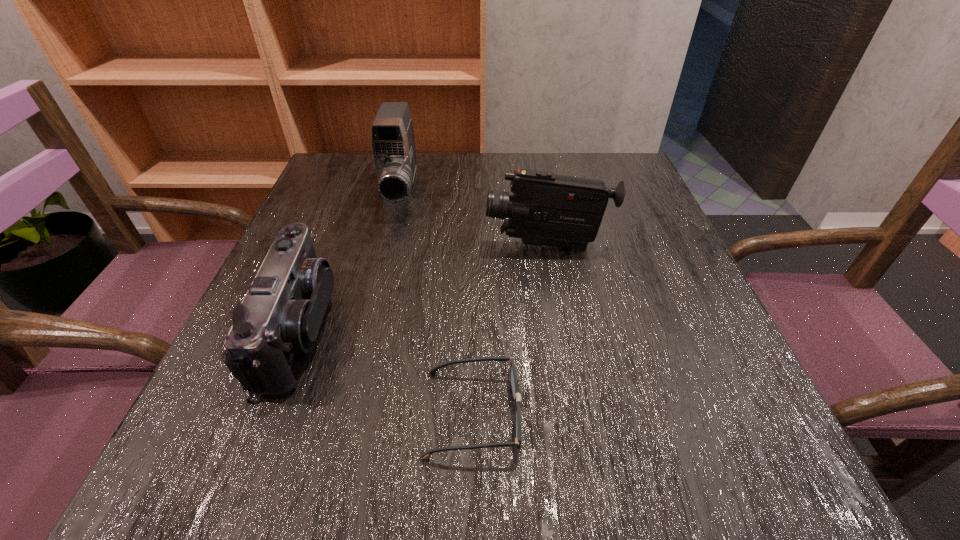
What are the coordinates of `the farthest camcorder` in the screenshot? It's located at (393, 145).

The height and width of the screenshot is (540, 960). In order to click on the farthest object in this screenshot , I will do `click(393, 145)`.

At what (x,y) coordinates should I click in order to perform the action: click on the second farthest object. Please return your answer as a coordinate pair (x, y). The image size is (960, 540). Looking at the image, I should click on (549, 209).

You are a GUI agent. You are given a task and a screenshot of the screen. Output one action in this format:
    pyautogui.click(x=<x>, y=<y>)
    Task: Click on the second farthest camcorder
    
    Given the screenshot: What is the action you would take?
    tap(549, 209)

The image size is (960, 540). I want to click on the third tallest object, so click(x=281, y=314).

Find the location of a particular element. The height and width of the screenshot is (540, 960). the nearest camcorder is located at coordinates (281, 314).

Locate an element on the screen. This screenshot has width=960, height=540. spectacles is located at coordinates (513, 376).

Image resolution: width=960 pixels, height=540 pixels. I want to click on blank space located at the front of the second object from left to right, highlighting the lens, so click(x=363, y=350).

Find the location of a particular element. free space located 0.100m on the front-facing side of the second farthest camcorder is located at coordinates (436, 245).

Locate an element on the screen. vacant space positioned 0.110m on the front-facing side of the second farthest camcorder is located at coordinates (431, 245).